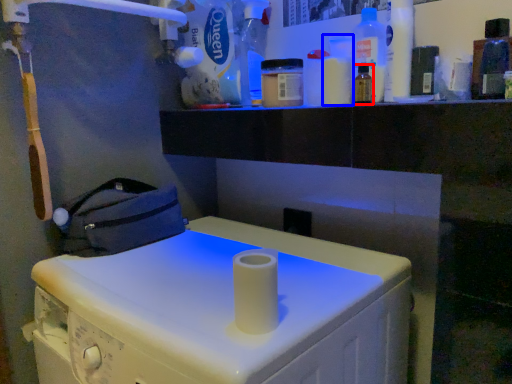
Question: Which object appears closest to the camera in this image, bottle (highlighted by a red box) or bottle (highlighted by a blue box)?

Choices:
 (A) bottle
 (B) bottle

Answer: (A)